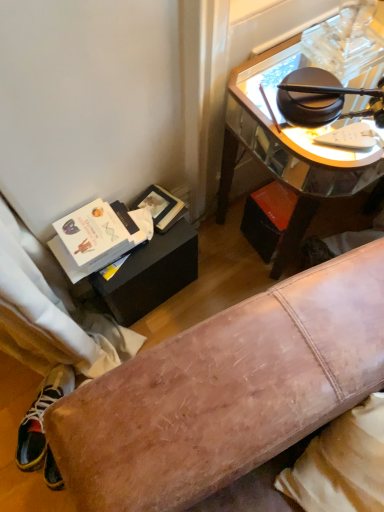
Question: Is shiny glass desk at upper right in front of or behind multicolored fabric shoe at lower left in the image?

Choices:
 (A) front
 (B) behind

Answer: (A)

Question: From their relative heights in the image, would you say shiny glass desk at upper right is taller or shorter than multicolored fabric shoe at lower left?

Choices:
 (A) short
 (B) tall

Answer: (B)

Question: Based on their positions, is shiny glass desk at upper right located to the left or right of multicolored fabric shoe at lower left?

Choices:
 (A) left
 (B) right

Answer: (B)

Question: From the image's perspective, is multicolored fabric shoe at lower left located above or below shiny glass desk at upper right?

Choices:
 (A) above
 (B) below

Answer: (B)

Question: Considering the positions of point (43, 450) and point (246, 148), is point (43, 450) closer or farther from the camera than point (246, 148)?

Choices:
 (A) farther
 (B) closer

Answer: (A)

Question: In the image, is multicolored fabric shoe at lower left on the left side or the right side of shiny glass desk at upper right?

Choices:
 (A) right
 (B) left

Answer: (B)

Question: Is multicolored fabric shoe at lower left bigger or smaller than shiny glass desk at upper right?

Choices:
 (A) big
 (B) small

Answer: (B)